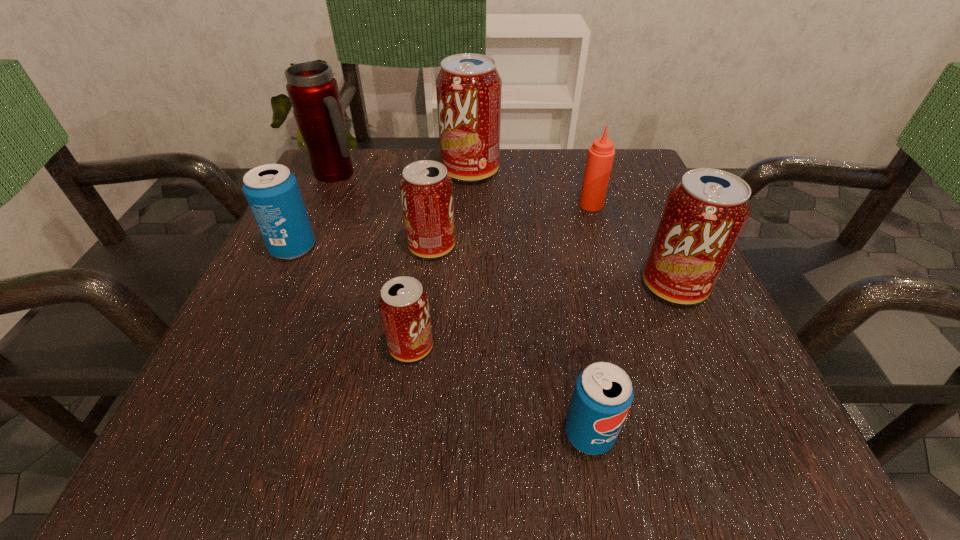
At what (x,y) coordinates should I click in order to perform the action: click on the closest red soda can to the farthest red soda can. Please return your answer as a coordinate pair (x, y). This screenshot has width=960, height=540. Looking at the image, I should click on (426, 190).

Locate an element on the screen. This screenshot has width=960, height=540. the second closest red soda can to the second farthest red soda can is located at coordinates (468, 87).

I want to click on vacant space that satisfies the following two spatial constraints: 1. on the side with the handle of the right blue soda can; 2. on the right side of the thermos bottle, so (x=221, y=434).

The width and height of the screenshot is (960, 540). Find the location of `vacant space that satisfies the following two spatial constraints: 1. on the back side of the second smallest red soda can; 2. on the side with the handle of the thermos bottle`. vacant space that satisfies the following two spatial constraints: 1. on the back side of the second smallest red soda can; 2. on the side with the handle of the thermos bottle is located at coordinates (441, 173).

Image resolution: width=960 pixels, height=540 pixels. Identify the location of vacant region that satisfies the following two spatial constraints: 1. on the side with the handle of the thermos bottle; 2. on the back side of the nearest object. (221, 434).

The image size is (960, 540). I want to click on vacant area that satisfies the following two spatial constraints: 1. on the back side of the second tallest soda can; 2. on the right side of the nearer blue soda can, so point(562,286).